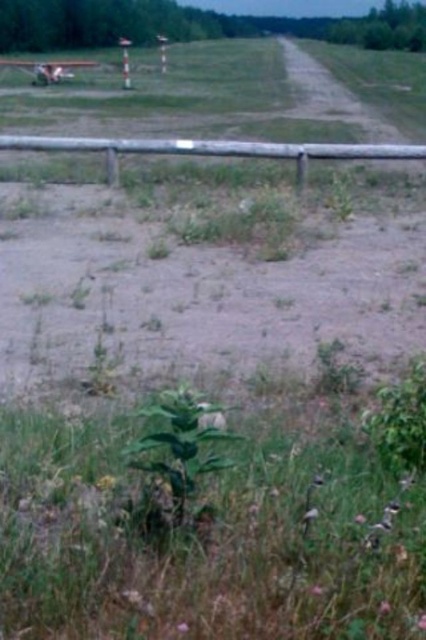
Between point (17, 545) and point (213, 465), which one is positioned in front?

Point (17, 545) is in front.

Who is positioned more to the left, green leafy grass at center or green leafy plant at center?

green leafy plant at center

Does point (256, 620) come behind point (132, 460)?

No.

In order to click on green leafy grass at center in this screenshot , I will do `click(203, 541)`.

Which is below, green leafy plant at center or brown wooden fence at center?

green leafy plant at center is below.

Which is more to the left, green leafy plant at center or brown wooden fence at center?

From the viewer's perspective, brown wooden fence at center appears more on the left side.

At what (x,y) coordinates should I click in order to perform the action: click on green leafy plant at center. Please return your answer as a coordinate pair (x, y). This screenshot has height=640, width=426. Looking at the image, I should click on (175, 461).

Can you confirm if green leafy grass at center is taller than brown wooden fence at center?

No.

Which of these two, green leafy grass at center or brown wooden fence at center, stands taller?

Result: Standing taller between the two is brown wooden fence at center.

Where is `green leafy grass at center`? green leafy grass at center is located at coordinates (203, 541).